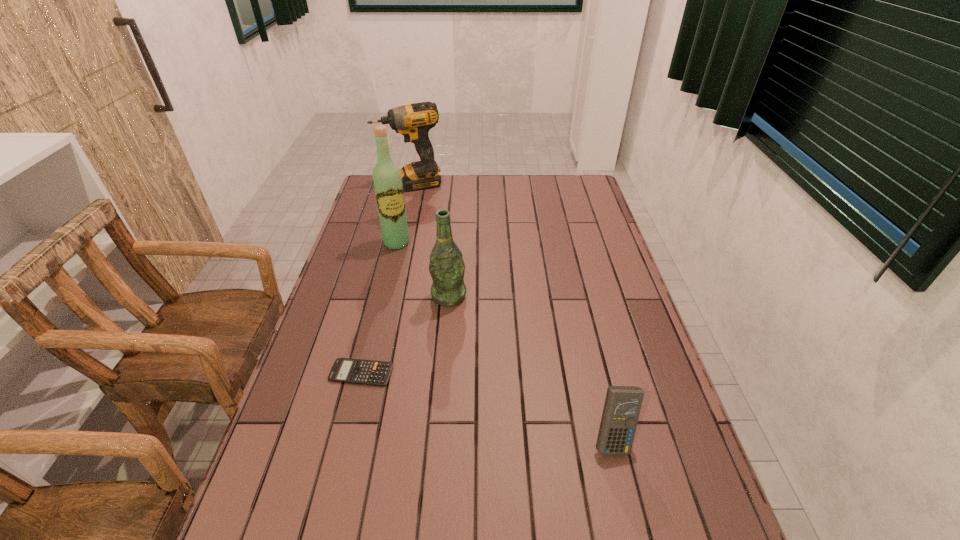
In the image, there is a desktop. At what (x,y) coordinates should I click in order to perform the action: click on free space at the far left corner. Please return your answer as a coordinate pair (x, y). This screenshot has height=540, width=960. Looking at the image, I should click on (372, 202).

Identify the location of free space at the far right corner of the desktop. Image resolution: width=960 pixels, height=540 pixels. (557, 188).

Locate an element on the screen. This screenshot has height=540, width=960. free spot between the second farthest object and the shorter calculator is located at coordinates (379, 308).

Locate an element on the screen. free spot between the fourth object from left to right and the right calculator is located at coordinates (531, 368).

Locate an element on the screen. free spot between the drill and the taller calculator is located at coordinates (512, 312).

Locate an element on the screen. free spot between the third farthest object and the fourth nearest object is located at coordinates (422, 269).

This screenshot has height=540, width=960. Identify the location of free space between the farthest object and the beer bottle. (430, 240).

Where is `free space between the nearer calculator and the drill`? free space between the nearer calculator and the drill is located at coordinates (512, 312).

Where is `free space between the second shortest object and the left calculator`? This screenshot has width=960, height=540. free space between the second shortest object and the left calculator is located at coordinates (487, 406).

At what (x,y) coordinates should I click in order to perform the action: click on object that stands as the third closest to the drill. Please return your answer as a coordinate pair (x, y). Looking at the image, I should click on (346, 370).